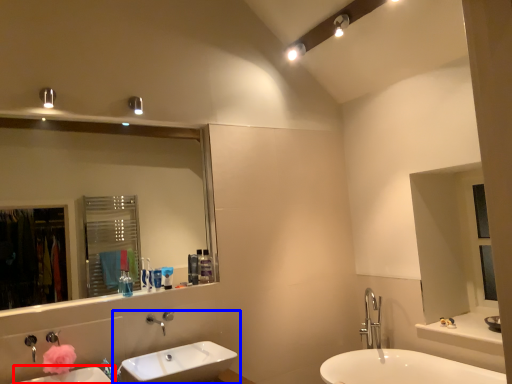
Question: Which object is closer to the camera taking this photo, sink (highlighted by a red box) or sink (highlighted by a blue box)?

Choices:
 (A) sink
 (B) sink

Answer: (A)